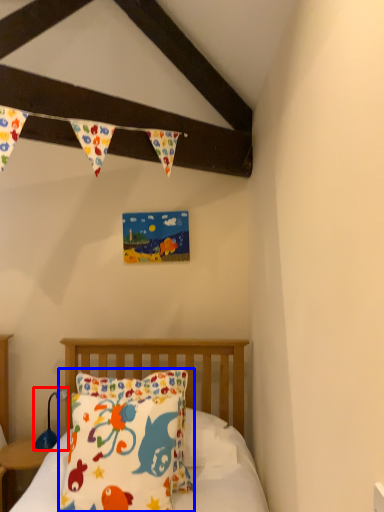
Question: Which of the following is the closest to the observer, lamp (highlighted by a red box) or pillow (highlighted by a blue box)?

Choices:
 (A) lamp
 (B) pillow

Answer: (B)